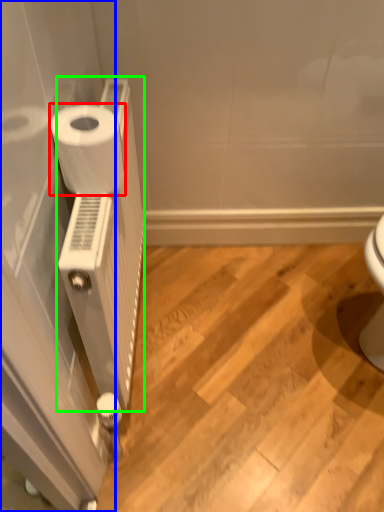
Question: Which is farther away from toilet paper (highlighted by a red box)? screen door (highlighted by a blue box) or radiator (highlighted by a green box)?

Choices:
 (A) screen door
 (B) radiator

Answer: (A)